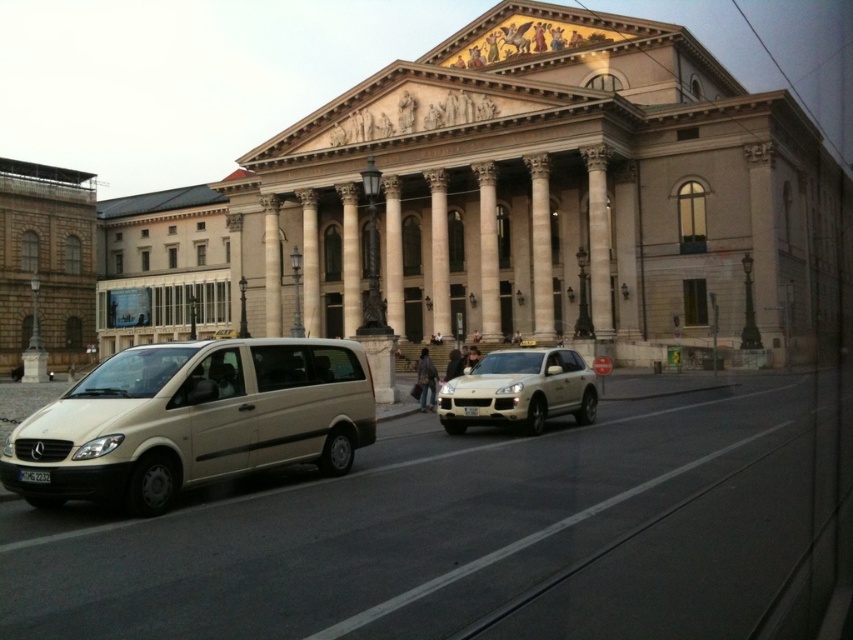
Does beige matte van at lower left have a greater height compared to metallic gold suv at center?

Correct, beige matte van at lower left is much taller as metallic gold suv at center.

Between beige matte van at lower left and metallic gold suv at center, which one appears on the left side from the viewer's perspective?

From the viewer's perspective, beige matte van at lower left appears more on the left side.

Where is `beige matte van at lower left`? Image resolution: width=853 pixels, height=640 pixels. beige matte van at lower left is located at coordinates (192, 420).